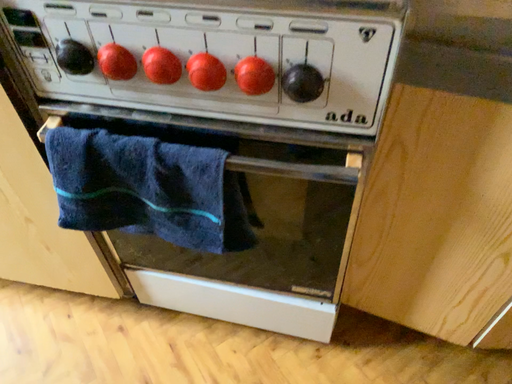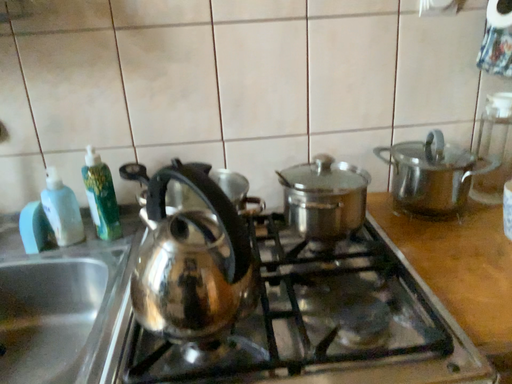
Question: How did the camera likely rotate when shooting the video?

Choices:
 (A) rotated left
 (B) rotated right

Answer: (B)